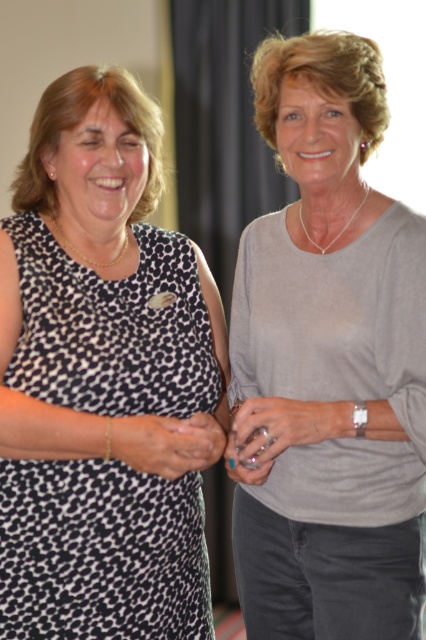
You are taking a photo of two women standing in a room. You notice two points in the image labeled as point (89, 348) and point (311, 420). Which point is closer to your camera lens?

Point (89, 348) is closer to the camera lens than point (311, 420) according to the description.

You are a photographer setting up for a group photo. You notice the black leopard print dress at left and the gray matte shirt at center in your frame. Which piece of clothing is positioned closer to the camera?

The black leopard print dress at left is closer to the viewer than the gray matte shirt at center, so the black leopard print dress at left is positioned closer to the camera.

You are standing in the room where the two women are. You want to place a small decoration exactly at the point marked as point (x=141, y=518). If you are 1.6 meters tall, can you comfortably reach that point without standing on anything?

The point (x=141, y=518) is 1.39 meters from the viewer. Since the average comfortable reaching height for a person 1.6 meters tall is typically around 2.1 meters, and 1.39 meters is within that range, you can comfortably reach the point without needing to stand on anything.